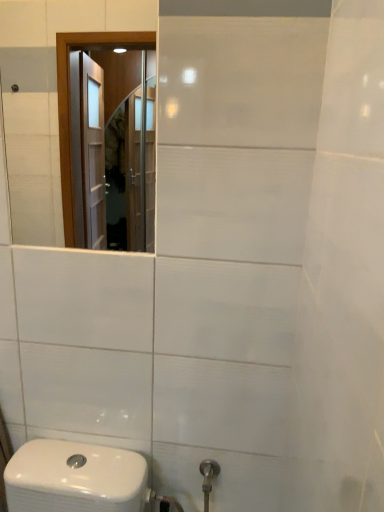
At what (x,y) coordinates should I click in order to perform the action: click on white glossy mirror at upper left. Please return your answer as a coordinate pair (x, y). The height and width of the screenshot is (512, 384). Looking at the image, I should click on (46, 99).

What do you see at coordinates (46, 99) in the screenshot? This screenshot has height=512, width=384. I see `white glossy mirror at upper left` at bounding box center [46, 99].

The image size is (384, 512). In order to click on white glossy mirror at upper left in this screenshot , I will do `click(46, 99)`.